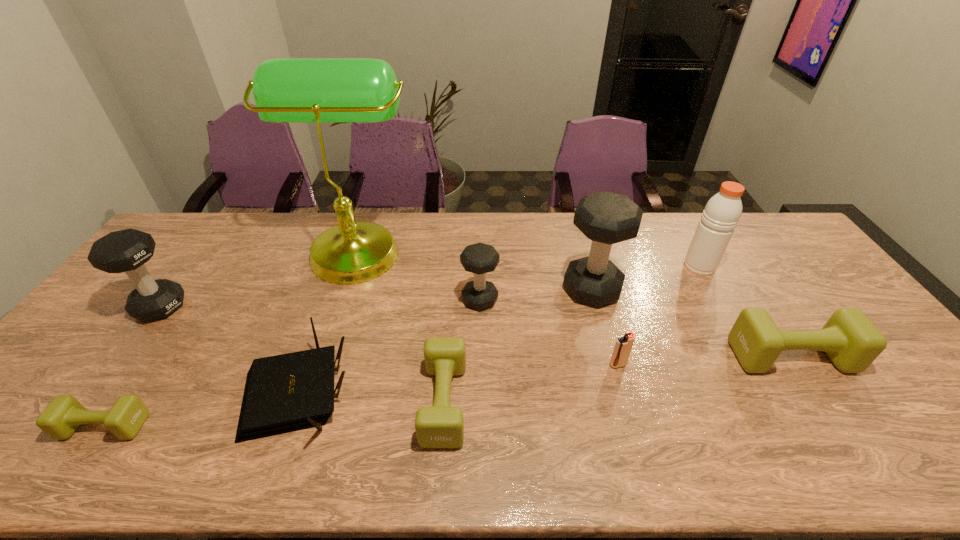
Locate an element on the screen. The width and height of the screenshot is (960, 540). free spot located on the right of the leftmost gray dumbbell is located at coordinates point(280,307).

Identify the location of vacant space located on the front of the second gray dumbbell from right to left. This screenshot has width=960, height=540. (480, 423).

Find the location of a particular element. This screenshot has width=960, height=540. free space located on the front of the third shortest dumbbell is located at coordinates (829, 415).

Identify the location of free space located 0.390m on the right of the black router. This screenshot has height=540, width=960. (517, 392).

The height and width of the screenshot is (540, 960). I want to click on free region located 0.160m on the right of the red igniter, so click(x=688, y=364).

At what (x,y) coordinates should I click in order to perform the action: click on vacant area situated 0.090m on the left of the fifth tallest dumbbell. Please return your answer as a coordinate pair (x, y). The image size is (960, 540). Looking at the image, I should click on (x=386, y=402).

You are a GUI agent. You are given a task and a screenshot of the screen. Output one action in this format:
    pyautogui.click(x=<x>, y=<y>)
    Task: Click on the blank area located 0.240m on the right of the leftmost olive dumbbell
    The height and width of the screenshot is (540, 960).
    Given the screenshot: What is the action you would take?
    pyautogui.click(x=249, y=426)

The width and height of the screenshot is (960, 540). I want to click on object present at the far edge, so click(318, 90).

Identify the location of router positioned at the near edge. (284, 393).

Locate an element on the screen. Image resolution: width=960 pixels, height=540 pixels. object located at the right edge is located at coordinates (852, 342).